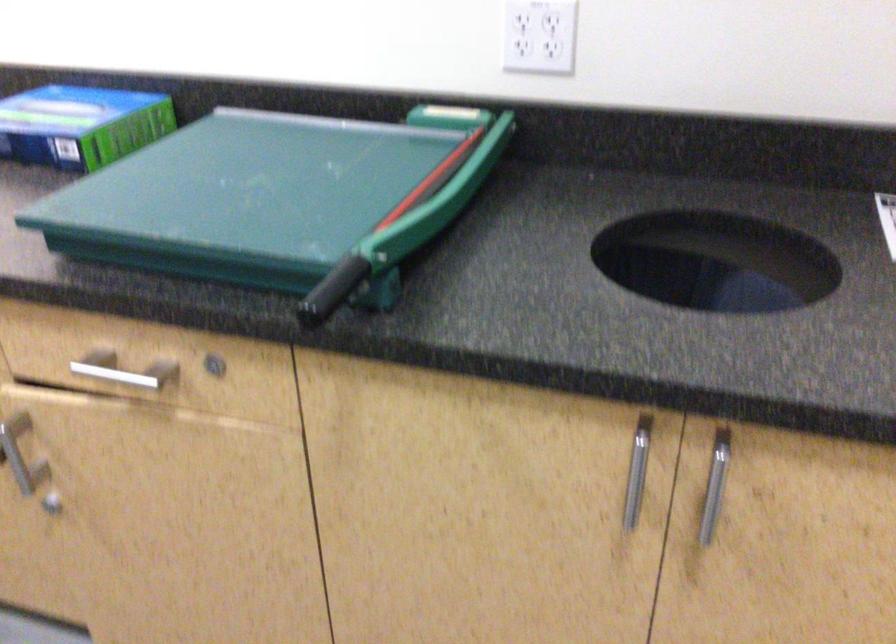
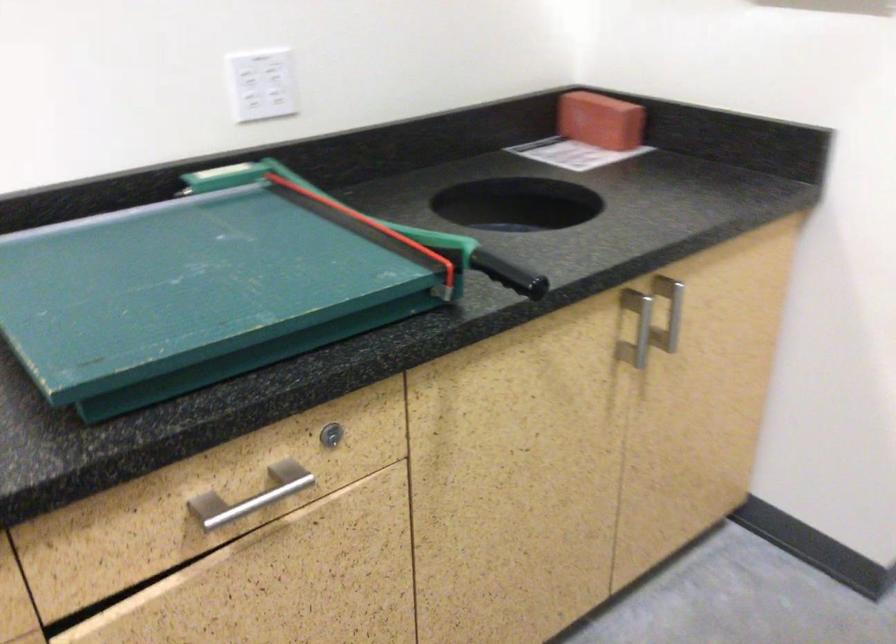
The point at (659,465) is marked in the first image. Where is the corresponding point in the second image?

(638, 324)